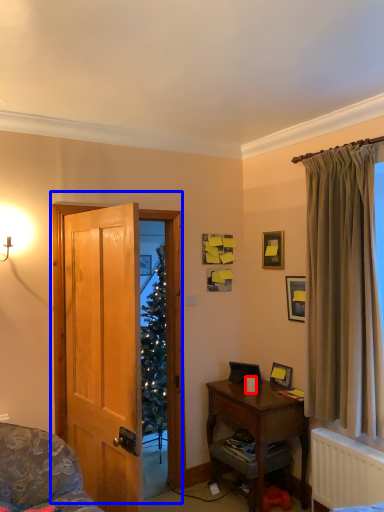
Question: Which object appears farthest to the camera in this image, coffee cup (highlighted by a red box) or door (highlighted by a blue box)?

Choices:
 (A) coffee cup
 (B) door

Answer: (A)